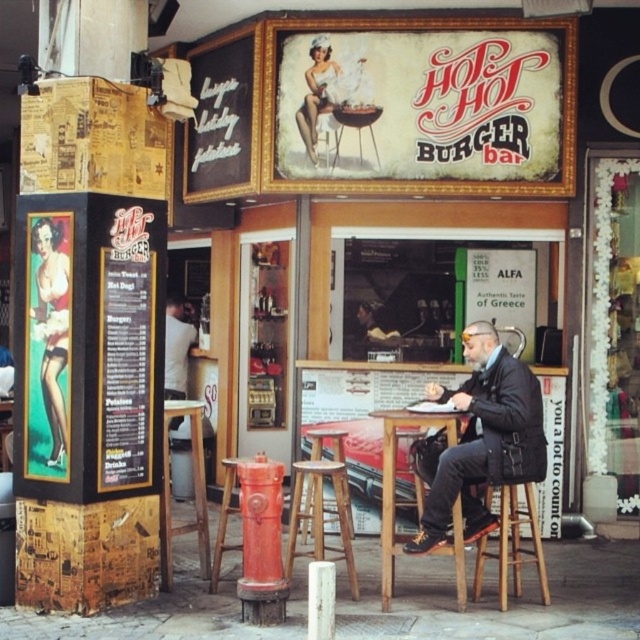
Can you confirm if wooden bar stool at lower center is bigger than metallic red fire hydrant at center?

Yes, wooden bar stool at lower center is bigger than metallic red fire hydrant at center.

Which of these two, wooden bar stool at lower center or metallic red fire hydrant at center, stands taller?

metallic red fire hydrant at center is taller.

Who is more distant from viewer, (484,502) or (234,476)?

The point (234,476) is behind.

Find the location of a particular element. The image size is (640, 640). wooden bar stool at lower center is located at coordinates (513, 545).

Does wooden table at center appear over dark brown leather jacket at center?

Incorrect, wooden table at center is not positioned above dark brown leather jacket at center.

Does wooden table at center appear on the left side of dark brown leather jacket at center?

In fact, wooden table at center is to the right of dark brown leather jacket at center.

The height and width of the screenshot is (640, 640). Identify the location of wooden table at center. (394, 483).

Which of these two, vintage cardboard sign at upper center or wooden bar stool at center, stands taller?

vintage cardboard sign at upper center is taller.

Does vintage cardboard sign at upper center lie in front of wooden bar stool at center?

No, it is not.

Which is behind, point (301, 99) or point (337, 502)?

Positioned behind is point (301, 99).

Where is `vintage cardboard sign at upper center`? vintage cardboard sign at upper center is located at coordinates (419, 106).